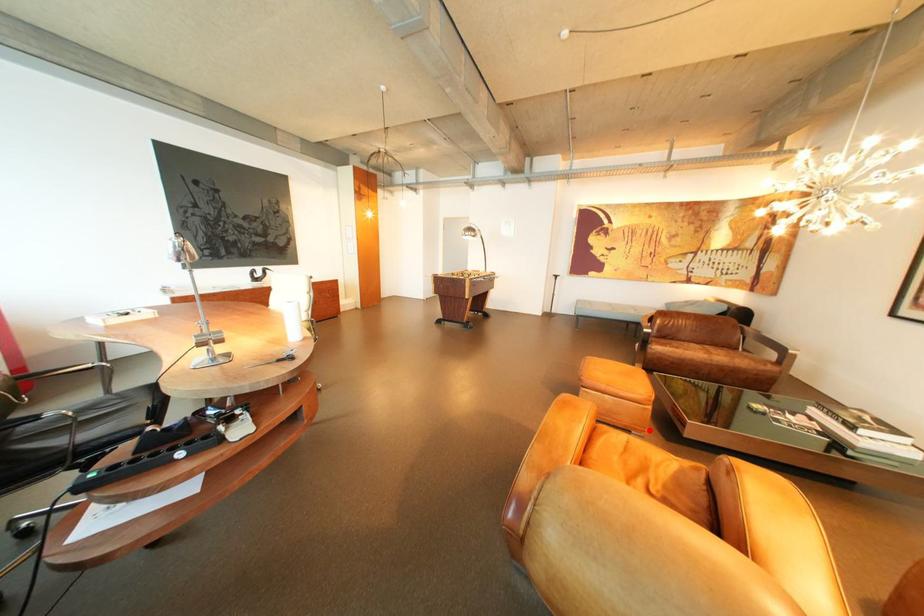
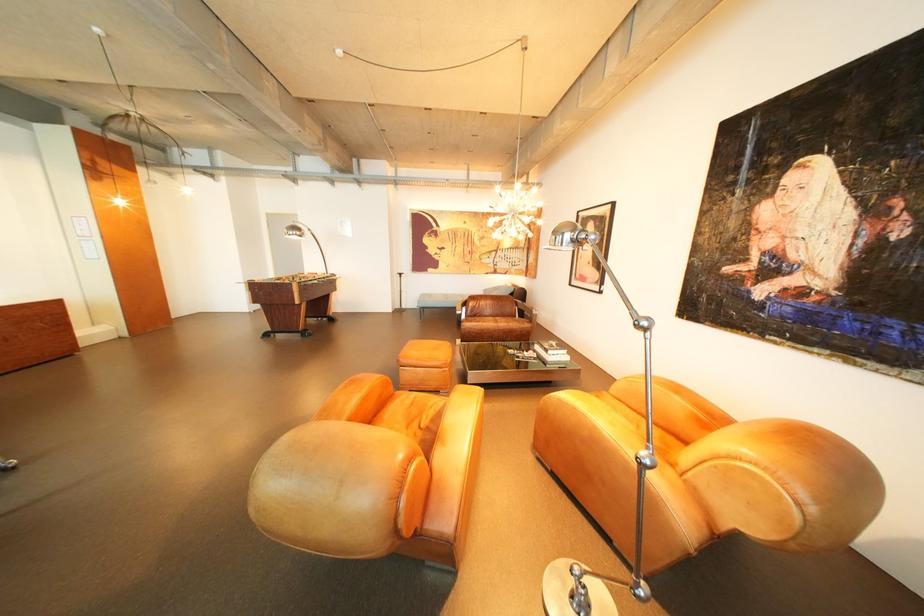
In the second image, find the point that corresponds to the highlighted location in the first image.

(456, 390)